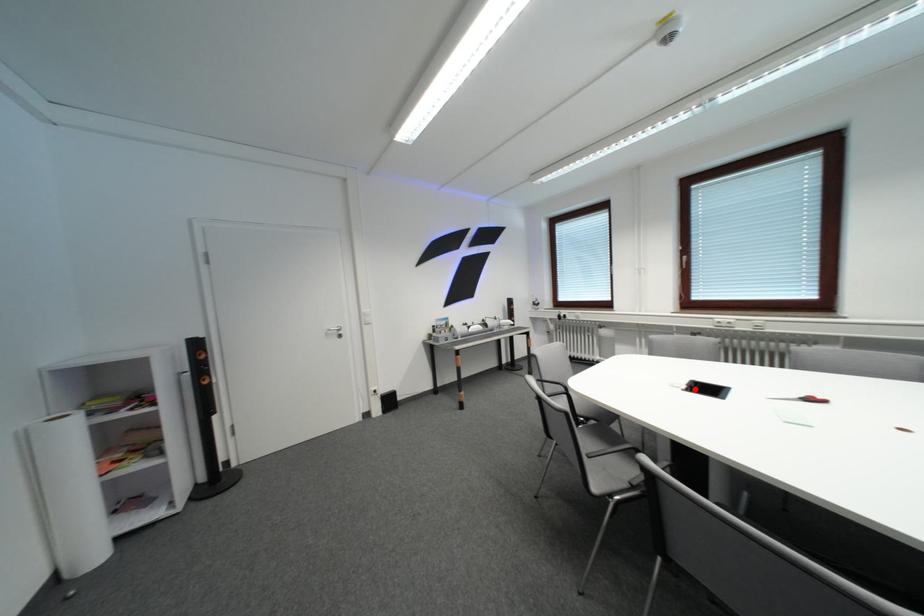
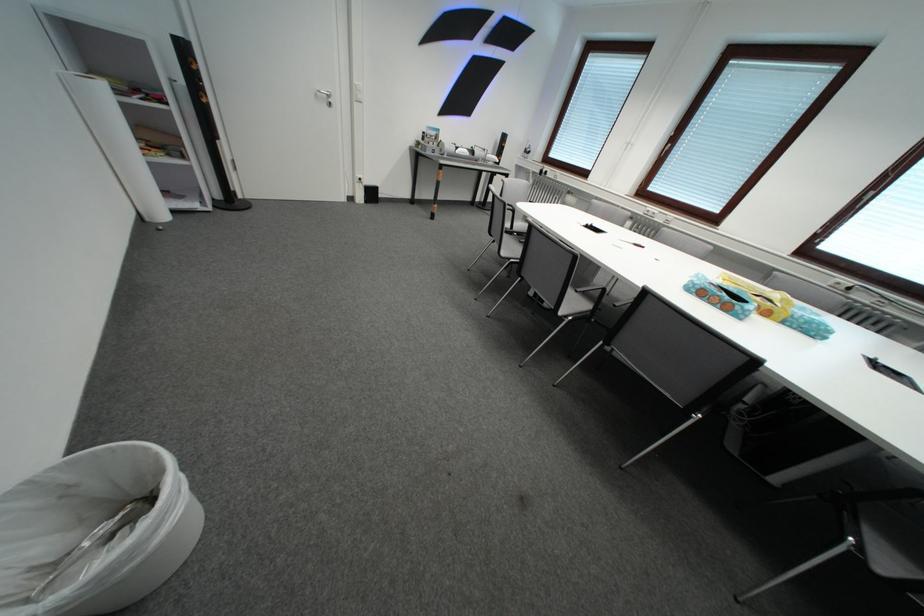
Question: I am providing you with two images of the same scene from different viewpoints. A red point is marked on the first image. At the location where the point appears in image 1, is it still visible in image 2?

Choices:
 (A) Yes
 (B) No

Answer: (B)